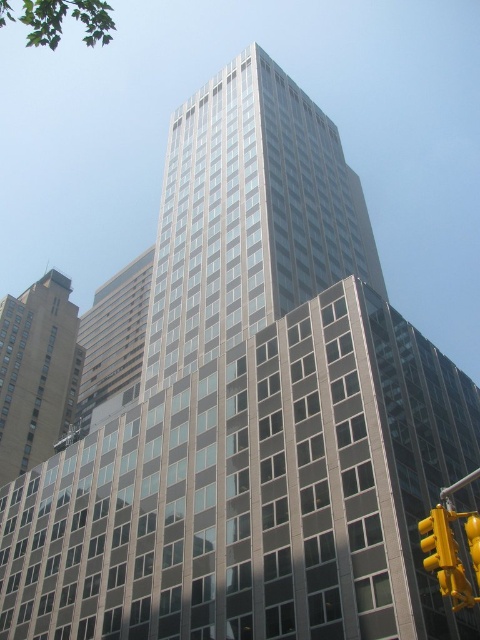
In the scene shown: You are a city planner analyzing the skyline. Given the beige stone building at left and the yellow metallic traffic light at lower right, which object occupies a larger horizontal space in the image?

The beige stone building at left has a greater width than the yellow metallic traffic light at lower right, so it occupies a larger horizontal space in the image.

You are standing in front of the modern high rise and want to take a photo that includes both the beige stone building at left and the yellow metallic traffic light at lower right. Which object should you position closer to the bottom of your camera frame?

You should position the yellow metallic traffic light at lower right closer to the bottom of your camera frame because the beige stone building at left is located above it.

You are a photographer standing in front of the beige stone building at left and the yellow plastic traffic light at lower right. You want to take a photo that includes both objects in the frame. Which object should you position closer to the left side of your camera viewfinder?

The beige stone building at left is to the left of the yellow plastic traffic light at lower right, so you should position the beige stone building at left closer to the left side of your camera viewfinder to include both in the frame.